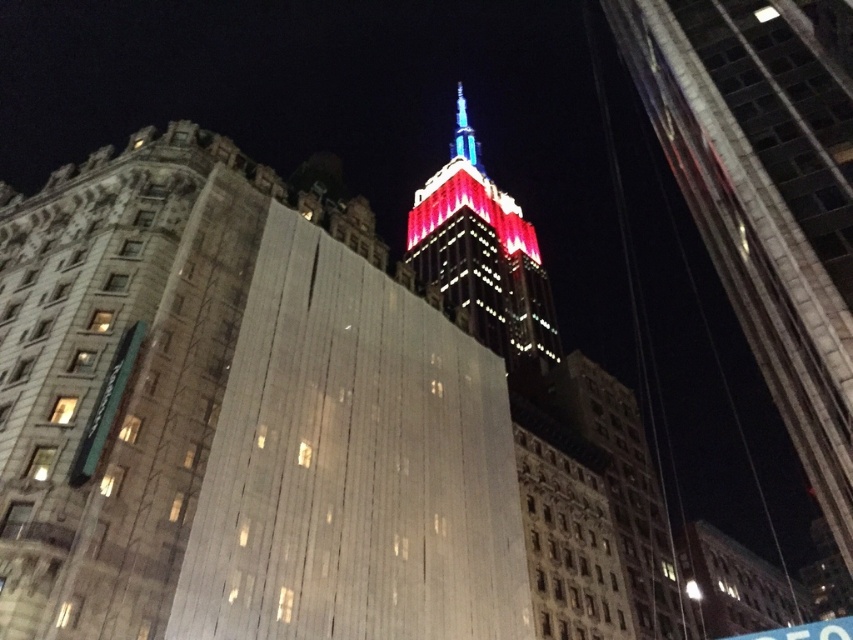
Which is below, green plastic sign at lower left or shiny blue spire at center?

Positioned lower is green plastic sign at lower left.

Is point (91, 461) positioned in front of point (462, 97)?

Yes, point (91, 461) is in front of point (462, 97).

This screenshot has height=640, width=853. What are the coordinates of `green plastic sign at lower left` in the screenshot? It's located at (106, 404).

Can you confirm if red glass tower at center is thinner than shiny blue spire at center?

No, red glass tower at center is not thinner than shiny blue spire at center.

This screenshot has height=640, width=853. Describe the element at coordinates (482, 256) in the screenshot. I see `red glass tower at center` at that location.

You are a GUI agent. You are given a task and a screenshot of the screen. Output one action in this format:
    pyautogui.click(x=<x>, y=<y>)
    Task: Click on the red glass tower at center
    The height and width of the screenshot is (640, 853).
    Given the screenshot: What is the action you would take?
    pyautogui.click(x=482, y=256)

Is smooth concrete skyscraper at right to the right of red glass tower at center from the viewer's perspective?

Yes, smooth concrete skyscraper at right is to the right of red glass tower at center.

Does smooth concrete skyscraper at right appear under red glass tower at center?

Indeed, smooth concrete skyscraper at right is positioned under red glass tower at center.

I want to click on smooth concrete skyscraper at right, so click(758, 227).